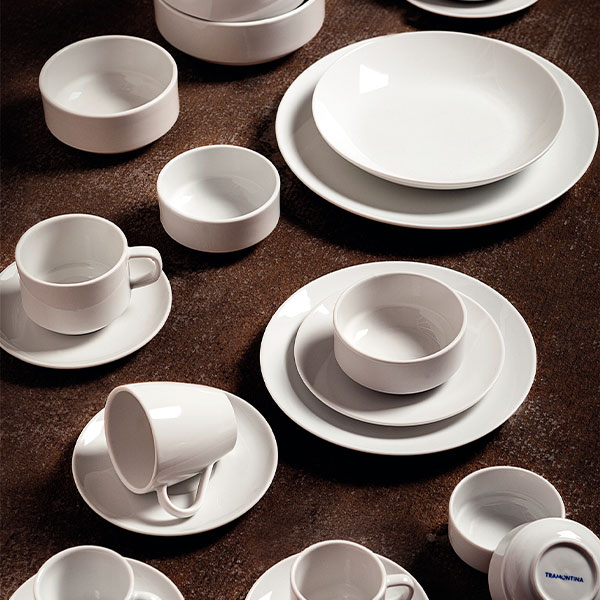
What are the coordinates of `this cup is tipped over` in the screenshot? It's located at (151, 453).